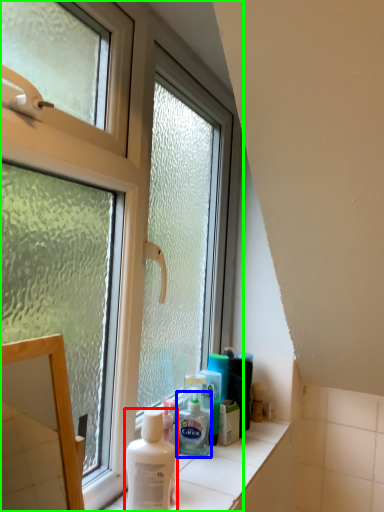
Question: Considering the real-world distances, which object is closest to shaving cream (highlighted by a red box)? shaving cream (highlighted by a blue box) or window (highlighted by a green box).

Choices:
 (A) shaving cream
 (B) window

Answer: (A)